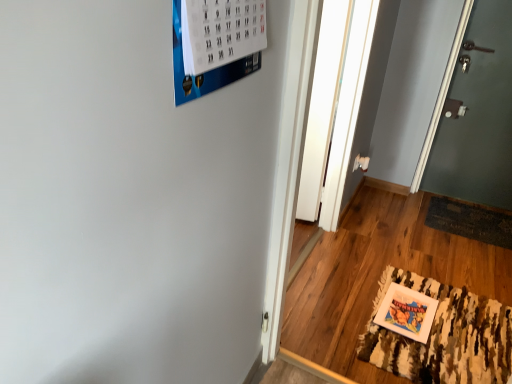
Image resolution: width=512 pixels, height=384 pixels. Find the location of `free point above camouflage-patterned rug at lower right (from a real-world perspective)`. free point above camouflage-patterned rug at lower right (from a real-world perspective) is located at coordinates (441, 327).